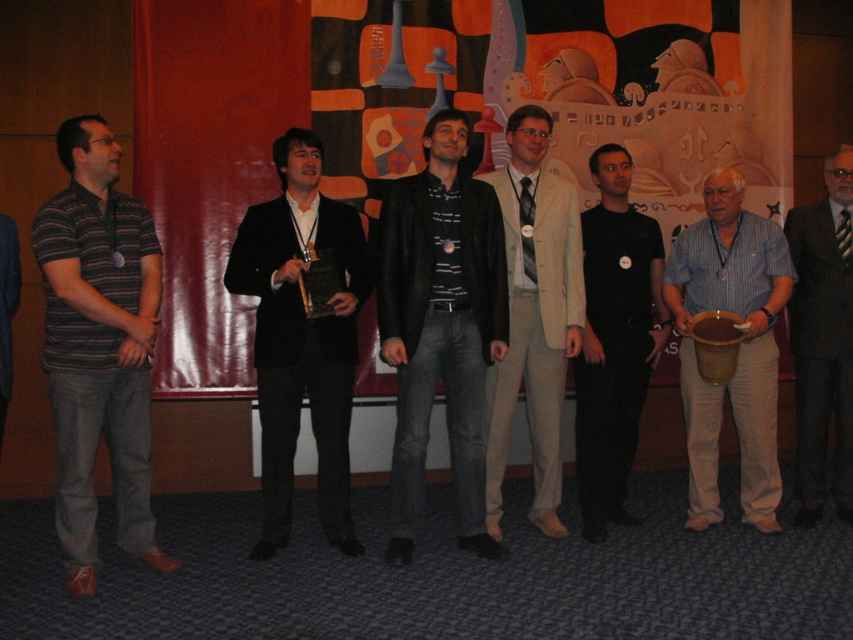
Locate an element on the screen. This screenshot has width=853, height=640. blue striped shirt at right is located at coordinates (738, 349).

Locate an element on the screen. This screenshot has height=640, width=853. blue striped shirt at right is located at coordinates (738, 349).

Find the location of `blue striped shirt at right`. blue striped shirt at right is located at coordinates (738, 349).

The width and height of the screenshot is (853, 640). In order to click on striped cotton shirt at left in this screenshot , I will do `click(97, 346)`.

Which is in front, point (103, 163) or point (640, 273)?

Point (103, 163) is more forward.

Between point (148, 529) and point (627, 460), which one is positioned behind?

Positioned behind is point (627, 460).

At what (x,y) coordinates should I click in order to perform the action: click on striped cotton shirt at left. Please return your answer as a coordinate pair (x, y). The width and height of the screenshot is (853, 640). Looking at the image, I should click on (97, 346).

This screenshot has height=640, width=853. I want to click on striped cotton shirt at left, so click(97, 346).

Does striped cotton shirt at left have a lesser height compared to striped shirt at center?

No.

Which is in front, point (97, 340) or point (848, 481)?

Point (97, 340) is more forward.

Where is `striped cotton shirt at left`? The image size is (853, 640). striped cotton shirt at left is located at coordinates (97, 346).